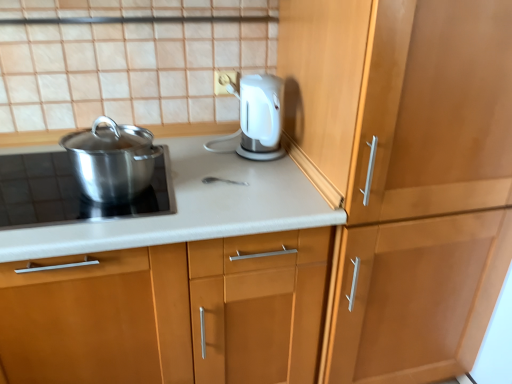
Question: From the image's perspective, is polished stainless steel pot at left located above wooden cabinet at right, the 1th cabinetry viewed from the right?

Choices:
 (A) no
 (B) yes

Answer: (B)

Question: Is wooden cabinet at right, marked as the second cabinetry in a left-to-right arrangement, at the back of polished stainless steel pot at left?

Choices:
 (A) yes
 (B) no

Answer: (B)

Question: Considering the relative positions of polished stainless steel pot at left and wooden cabinet at right, marked as the second cabinetry in a left-to-right arrangement, in the image provided, is polished stainless steel pot at left to the right of wooden cabinet at right, marked as the second cabinetry in a left-to-right arrangement, from the viewer's perspective?

Choices:
 (A) yes
 (B) no

Answer: (B)

Question: Is polished stainless steel pot at left closer to the viewer compared to wooden cabinet at right, marked as the second cabinetry in a left-to-right arrangement?

Choices:
 (A) yes
 (B) no

Answer: (B)

Question: Can wooden cabinet at right, marked as the second cabinetry in a left-to-right arrangement, be found inside polished stainless steel pot at left?

Choices:
 (A) yes
 (B) no

Answer: (B)

Question: In the image, is polished stainless steel pot at left on the left side or the right side of polished stainless steel pot at left?

Choices:
 (A) right
 (B) left

Answer: (A)

Question: From the image's perspective, is polished stainless steel pot at left positioned above or below polished stainless steel pot at left?

Choices:
 (A) above
 (B) below

Answer: (A)

Question: Is polished stainless steel pot at left taller or shorter than polished stainless steel pot at left?

Choices:
 (A) tall
 (B) short

Answer: (A)

Question: Relative to polished stainless steel pot at left, is polished stainless steel pot at left in front or behind?

Choices:
 (A) front
 (B) behind

Answer: (B)

Question: Choose the correct answer: Is matte white countertop at center, arranged as the 1th cabinetry when viewed from the left, inside polished stainless steel pot at left or outside it?

Choices:
 (A) outside
 (B) inside

Answer: (A)

Question: In terms of width, does matte white countertop at center, the second cabinetry when ordered from right to left, look wider or thinner when compared to polished stainless steel pot at left?

Choices:
 (A) wide
 (B) thin

Answer: (A)

Question: Would you say matte white countertop at center, arranged as the 1th cabinetry when viewed from the left, is to the left or to the right of polished stainless steel pot at left in the picture?

Choices:
 (A) right
 (B) left

Answer: (A)

Question: Is point (124, 281) positioned closer to the camera than point (24, 163)?

Choices:
 (A) farther
 (B) closer

Answer: (B)

Question: In the image, is matte white countertop at center, the second cabinetry when ordered from right to left, on the left side or the right side of polished stainless steel pot at left?

Choices:
 (A) right
 (B) left

Answer: (B)

Question: From a real-world perspective, is matte white countertop at center, the second cabinetry when ordered from right to left, above or below polished stainless steel pot at left?

Choices:
 (A) below
 (B) above

Answer: (A)